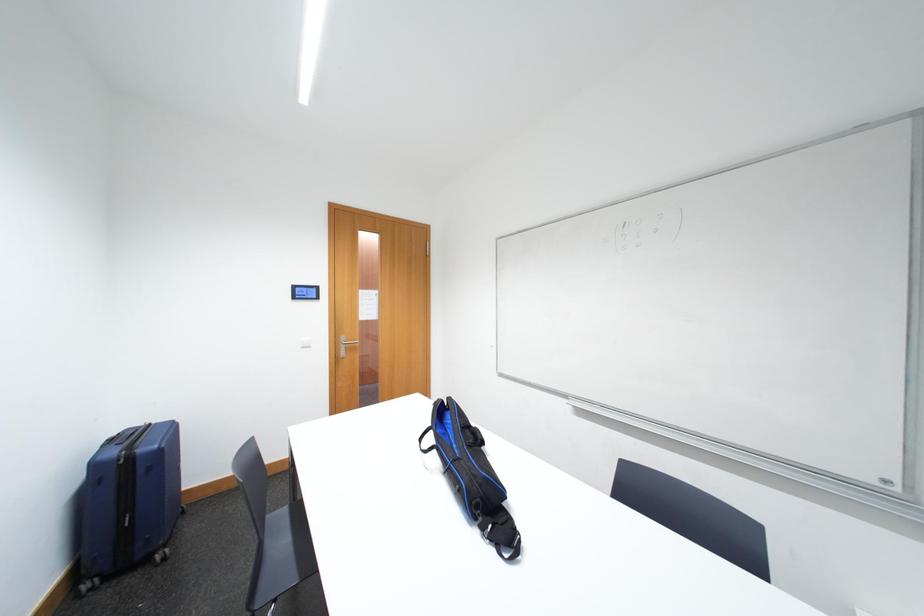
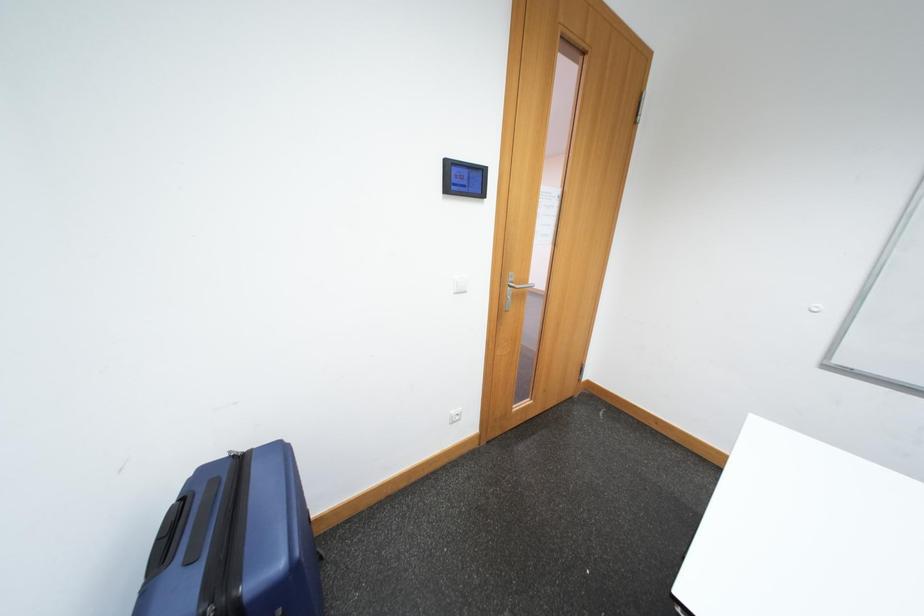
In a continuous first-person perspective shot, in which direction is the camera moving?

The cameraman moved toward left, forward.